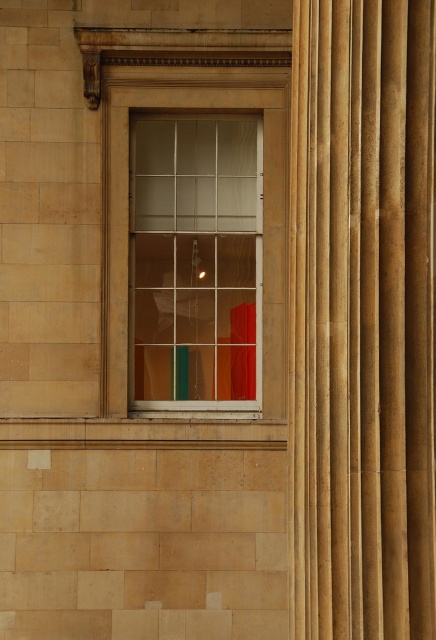
Which is more to the right, matte fabric curtain at center or clear glass window at center?

From the viewer's perspective, matte fabric curtain at center appears more on the right side.

The image size is (436, 640). I want to click on matte fabric curtain at center, so click(361, 320).